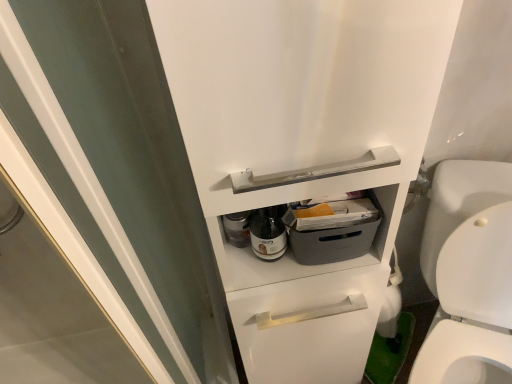
Question: From a real-world perspective, is transparent glass screen door at upper left physically located above or below translucent glass bottle at center?

Choices:
 (A) above
 (B) below

Answer: (B)

Question: From the image's perspective, is transparent glass screen door at upper left positioned above or below translucent glass bottle at center?

Choices:
 (A) above
 (B) below

Answer: (B)

Question: Estimate the real-world distances between objects in this image. Which object is farther from the white glossy toilet at right?

Choices:
 (A) transparent glass screen door at upper left
 (B) translucent glass bottle at center

Answer: (A)

Question: Based on their relative distances, which object is nearer to the transparent glass screen door at upper left?

Choices:
 (A) white glossy toilet at right
 (B) translucent glass bottle at center

Answer: (B)